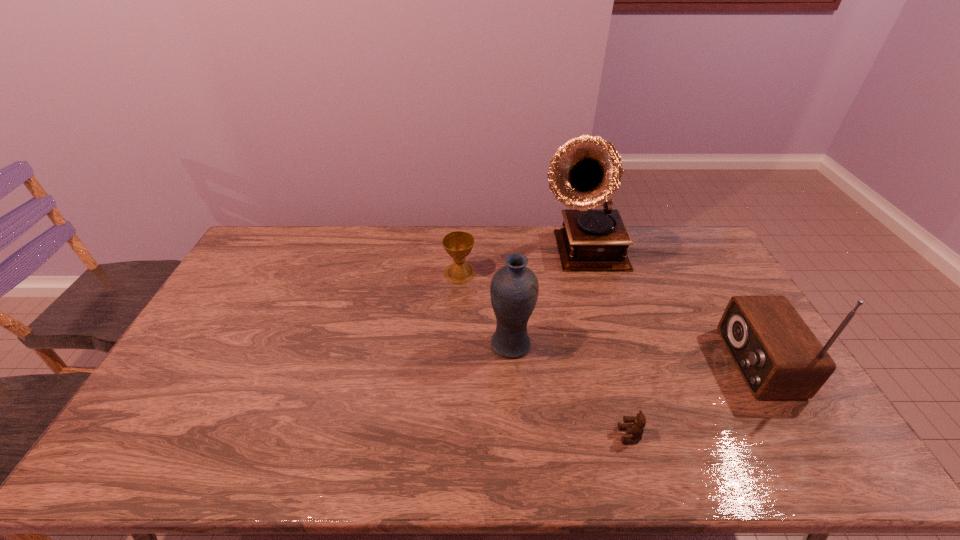
I want to click on free space at the far edge of the desktop, so click(534, 240).

Where is `vacant area at the near edge of the desktop`? The width and height of the screenshot is (960, 540). vacant area at the near edge of the desktop is located at coordinates (554, 473).

This screenshot has height=540, width=960. What are the coordinates of `vacant space at the left edge` in the screenshot? It's located at (239, 289).

This screenshot has width=960, height=540. In the image, there is a desktop. Find the location of `free region at the far left corner`. free region at the far left corner is located at coordinates (259, 251).

This screenshot has height=540, width=960. I want to click on vacant space at the far right corner of the desktop, so click(686, 257).

Find the location of `vacant region at the near right corner`. vacant region at the near right corner is located at coordinates (785, 468).

Locate an element on the screen. The height and width of the screenshot is (540, 960). free spot between the radio receiver and the tallest object is located at coordinates [x=671, y=308].

I want to click on vacant area that lies between the second shortest object and the fourth object from right to left, so click(486, 309).

Image resolution: width=960 pixels, height=540 pixels. I want to click on free space between the fourth object from right to left and the tallest object, so click(547, 300).

Locate an element on the screen. This screenshot has width=960, height=540. vacant area between the rightmost object and the vase is located at coordinates (634, 353).